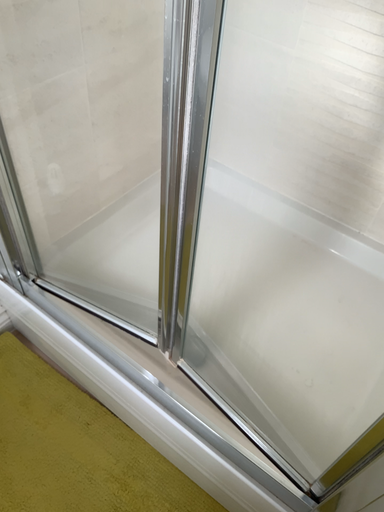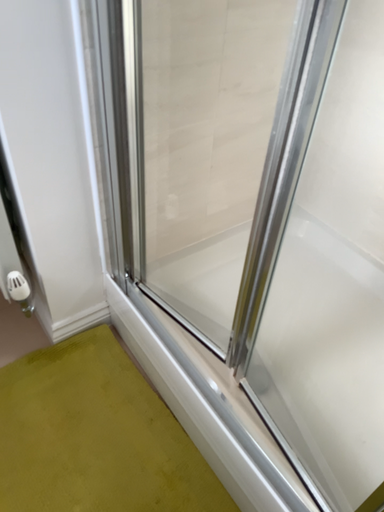
Question: Which way did the camera rotate in the video?

Choices:
 (A) rotated left
 (B) rotated right

Answer: (A)